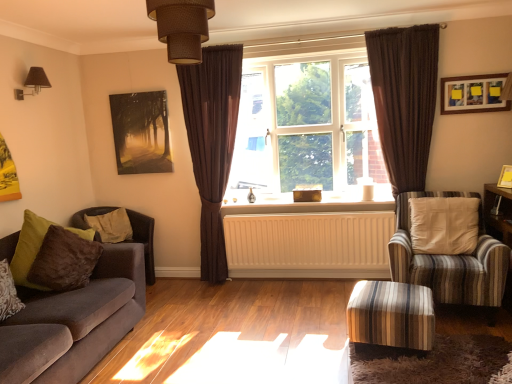
Question: Is velvet brown armchair at left, the 1th chair from the back, facing towards velvet sofa at left?

Choices:
 (A) no
 (B) yes

Answer: (A)

Question: Can you confirm if velvet brown armchair at left, the 2th chair from the right, is thinner than velvet sofa at left?

Choices:
 (A) yes
 (B) no

Answer: (A)

Question: From the image's perspective, is velvet brown armchair at left, which appears as the 2th chair when viewed from the front, located beneath velvet sofa at left?

Choices:
 (A) no
 (B) yes

Answer: (A)

Question: Is velvet brown armchair at left, which is counted as the 1th chair, starting from the left, shorter than velvet sofa at left?

Choices:
 (A) yes
 (B) no

Answer: (A)

Question: Does velvet brown armchair at left, the 2th chair from the right, have a greater width compared to velvet sofa at left?

Choices:
 (A) no
 (B) yes

Answer: (A)

Question: From a real-world perspective, is velvet brown armchair at left, which appears as the 2th chair when viewed from the front, physically located above or below white matte radiator at center?

Choices:
 (A) below
 (B) above

Answer: (B)

Question: Considering the positions of velvet brown armchair at left, which is counted as the 1th chair, starting from the left, and white matte radiator at center in the image, is velvet brown armchair at left, which is counted as the 1th chair, starting from the left, wider or thinner than white matte radiator at center?

Choices:
 (A) thin
 (B) wide

Answer: (B)

Question: Do you think velvet brown armchair at left, which appears as the 2th chair when viewed from the front, is within white matte radiator at center, or outside of it?

Choices:
 (A) inside
 (B) outside

Answer: (B)

Question: Is velvet brown armchair at left, the 1th chair from the back, in front of or behind white matte radiator at center in the image?

Choices:
 (A) behind
 (B) front

Answer: (B)

Question: In the image, is velvet brown pillow at lower left, which is the second pillow from back to front, on the left side or the right side of white painted wood at center?

Choices:
 (A) left
 (B) right

Answer: (A)

Question: Does point (7, 273) appear closer or farther from the camera than point (324, 203)?

Choices:
 (A) closer
 (B) farther

Answer: (A)

Question: Based on their sizes in the image, would you say velvet brown pillow at lower left, the first pillow positioned from the front, is bigger or smaller than white painted wood at center?

Choices:
 (A) big
 (B) small

Answer: (B)

Question: Is velvet brown pillow at lower left, the first pillow positioned from the front, spatially inside white painted wood at center, or outside of it?

Choices:
 (A) inside
 (B) outside

Answer: (B)

Question: From a real-world perspective, is brown plush pillow at left, marked as the 2th pillow in a front-to-back arrangement, above or below wooden picture frame at upper right, the first picture frame positioned from the right?

Choices:
 (A) below
 (B) above

Answer: (A)

Question: In the image, is brown plush pillow at left, the first pillow viewed from the back, positioned in front of or behind wooden picture frame at upper right, arranged as the third picture frame when viewed from the back?

Choices:
 (A) front
 (B) behind

Answer: (B)